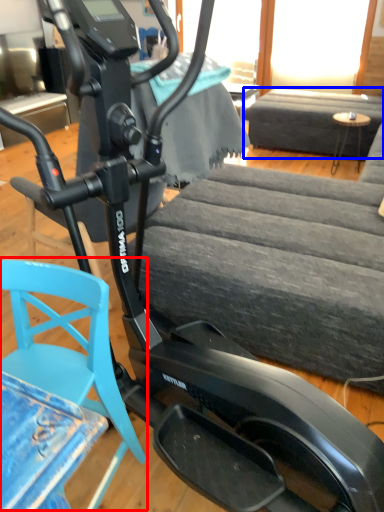
Question: Among these objects, which one is nearest to the camera, swivel chair (highlighted by a red box) or couch (highlighted by a blue box)?

Choices:
 (A) swivel chair
 (B) couch

Answer: (A)